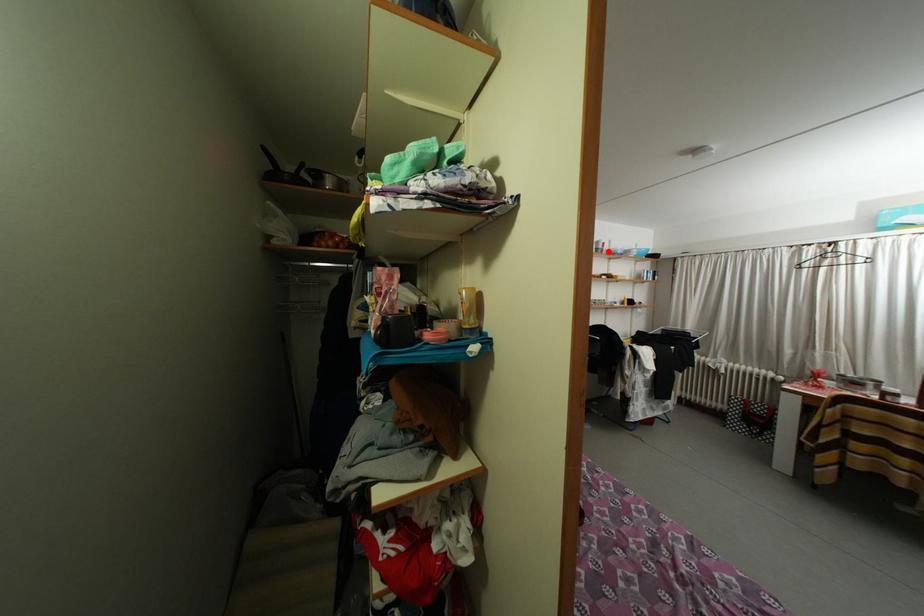
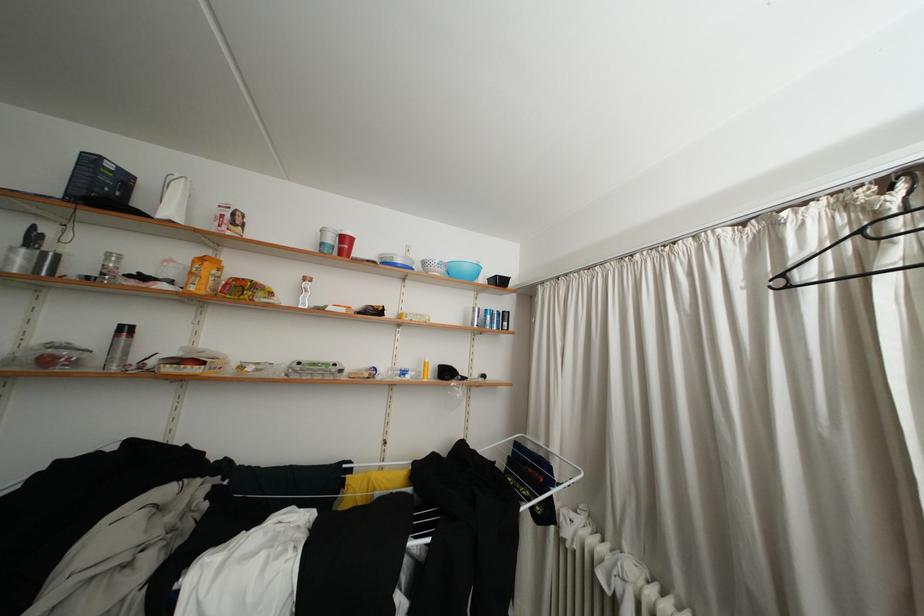
Where in the second image is the point corresponding to the highlighted location from the first image?

(338, 245)